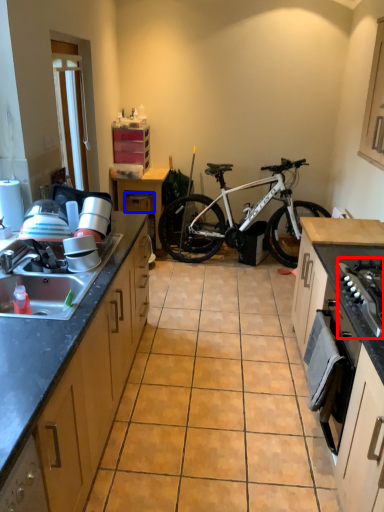
Question: Which point is closer to the camera, gas stove (highlighted by a red box) or drawer (highlighted by a blue box)?

Choices:
 (A) gas stove
 (B) drawer

Answer: (A)